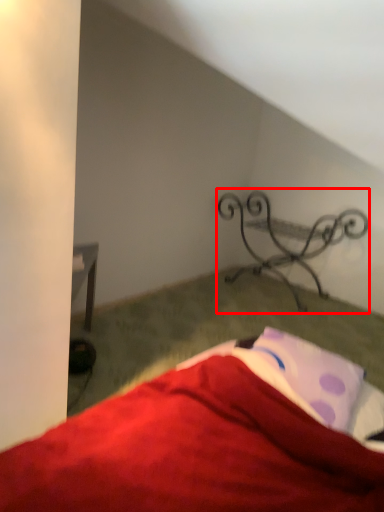
Question: Where is furniture (annotated by the red box) located in relation to sheet in the image?

Choices:
 (A) right
 (B) left

Answer: (A)